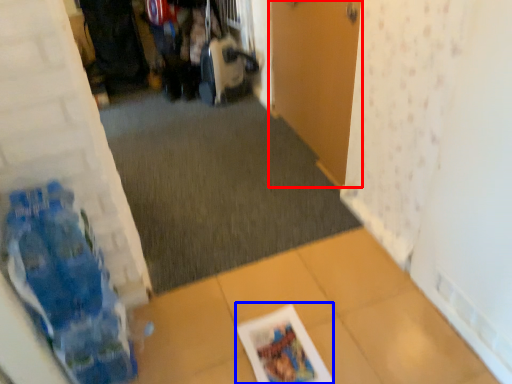
Question: Which object appears farthest to the camera in this image, door (highlighted by a red box) or magazine (highlighted by a blue box)?

Choices:
 (A) door
 (B) magazine

Answer: (A)